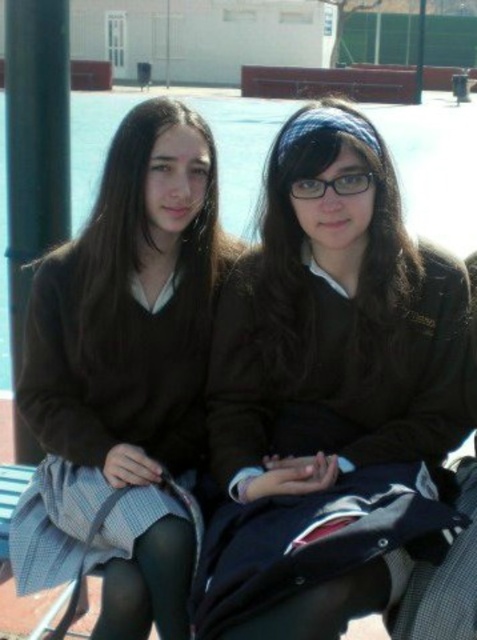
Is the position of matte black jacket at center less distant than that of black metal pole at left?

Yes.

Image resolution: width=477 pixels, height=640 pixels. I want to click on matte black jacket at center, so click(x=330, y=397).

Find the location of a particular element. This screenshot has height=640, width=477. matte black jacket at center is located at coordinates (330, 397).

Does matte brown sweater at left have a lesser width compared to black metal pole at left?

In fact, matte brown sweater at left might be wider than black metal pole at left.

Between matte brown sweater at left and black metal pole at left, which one has less height?

matte brown sweater at left is shorter.

Is point (170, 541) in front of point (8, 38)?

Yes, point (170, 541) is closer to viewer.

Find the location of a particular element. The width and height of the screenshot is (477, 640). matte brown sweater at left is located at coordinates (124, 374).

Looking at this image, does matte black jacket at center appear over matte brown sweater at left?

Indeed, matte black jacket at center is positioned over matte brown sweater at left.

Describe the element at coordinates (330, 397) in the screenshot. I see `matte black jacket at center` at that location.

Which is in front, point (413, 275) or point (194, 547)?

Point (194, 547)

The image size is (477, 640). I want to click on matte black jacket at center, so click(330, 397).